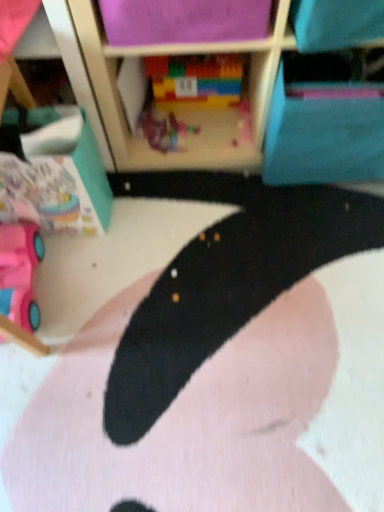
Where is `vacant area that lies between pink plastic toy car at lower left, marked as the first toy in a left-to-right arrangement, and blue fabric cabinet at upper right`? vacant area that lies between pink plastic toy car at lower left, marked as the first toy in a left-to-right arrangement, and blue fabric cabinet at upper right is located at coordinates (176, 233).